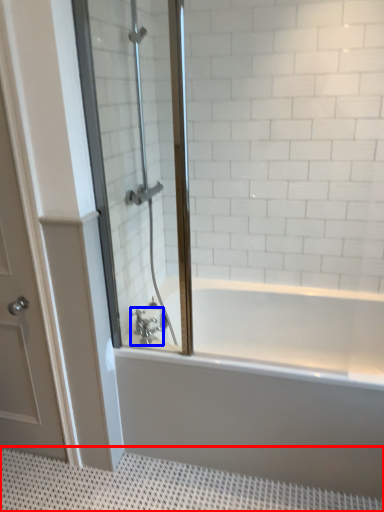
Question: Among these objects, which one is farthest to the camera, bath mat (highlighted by a red box) or tap (highlighted by a blue box)?

Choices:
 (A) bath mat
 (B) tap

Answer: (B)